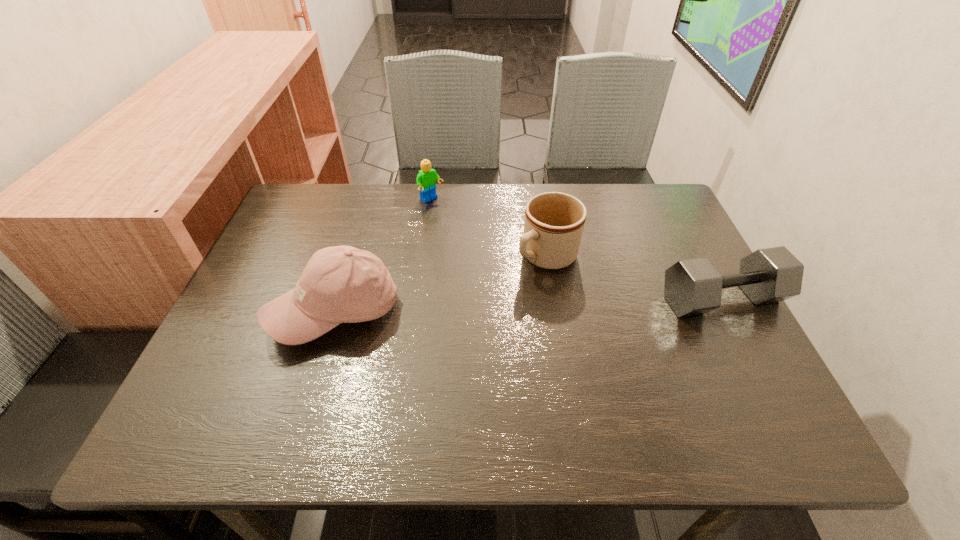
The width and height of the screenshot is (960, 540). Identify the location of vacant space at the far right corner. (652, 197).

Image resolution: width=960 pixels, height=540 pixels. In order to click on vacant space at the near right corner in this screenshot , I will do `click(695, 363)`.

Locate an element on the screen. Image resolution: width=960 pixels, height=540 pixels. unoccupied area between the dumbbell and the baseball cap is located at coordinates (528, 305).

You are a GUI agent. You are given a task and a screenshot of the screen. Output one action in this format:
    pyautogui.click(x=<x>, y=<y>)
    Task: Click on the vacant area that lies between the second object from right to left and the second object from left to right
    Image resolution: width=960 pixels, height=540 pixels.
    Given the screenshot: What is the action you would take?
    pyautogui.click(x=489, y=228)

Locate an element on the screen. Image resolution: width=960 pixels, height=540 pixels. vacant point located between the leftmost object and the farthest object is located at coordinates (383, 255).

Find the location of a particular element. The image size is (960, 540). free space that is in between the rightmost object and the third object from left to right is located at coordinates (634, 278).

Where is `empty location between the mug and the dumbbell`? Image resolution: width=960 pixels, height=540 pixels. empty location between the mug and the dumbbell is located at coordinates (634, 278).

The width and height of the screenshot is (960, 540). I want to click on free spot between the mug and the Lego, so click(x=489, y=228).

Where is `vacant area between the leftmost object and the mug`? vacant area between the leftmost object and the mug is located at coordinates (441, 284).

Locate an element on the screen. This screenshot has height=540, width=960. empty location between the rightmost object and the leftmost object is located at coordinates (528, 305).